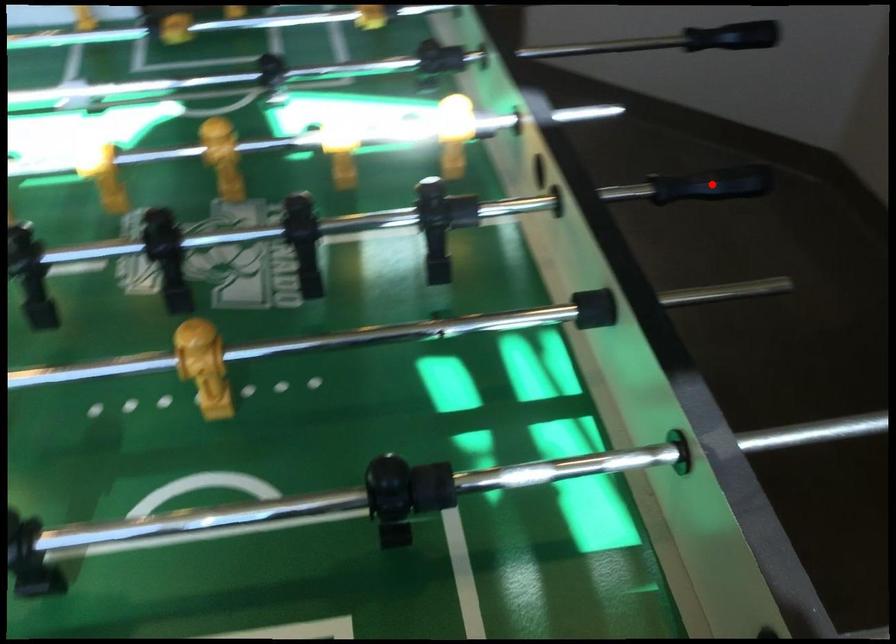
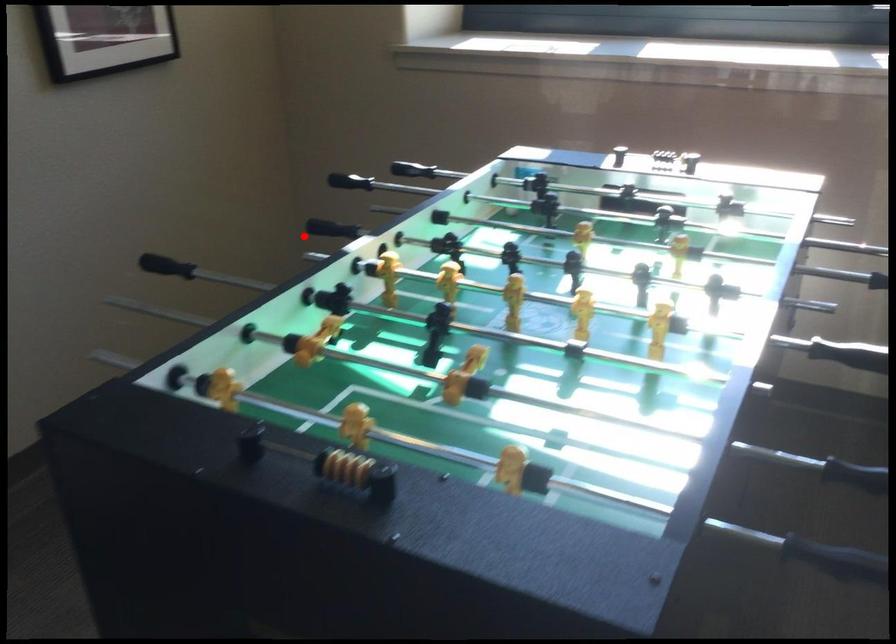
I am providing you with two images of the same scene from different viewpoints. A red point is marked on the first image and another point is marked on the second image. Are the points marked in image1 and image2 representing the same 3D position?

Yes